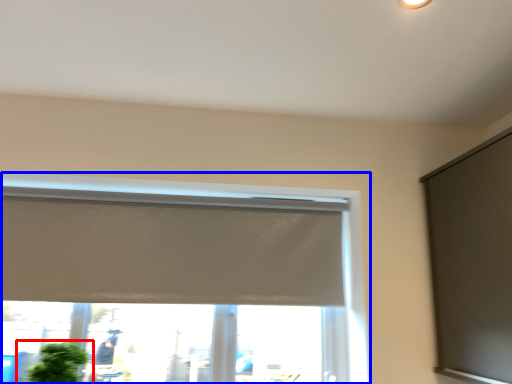
Question: Among these objects, which one is farthest to the camera, houseplant (highlighted by a red box) or window (highlighted by a blue box)?

Choices:
 (A) houseplant
 (B) window

Answer: (B)